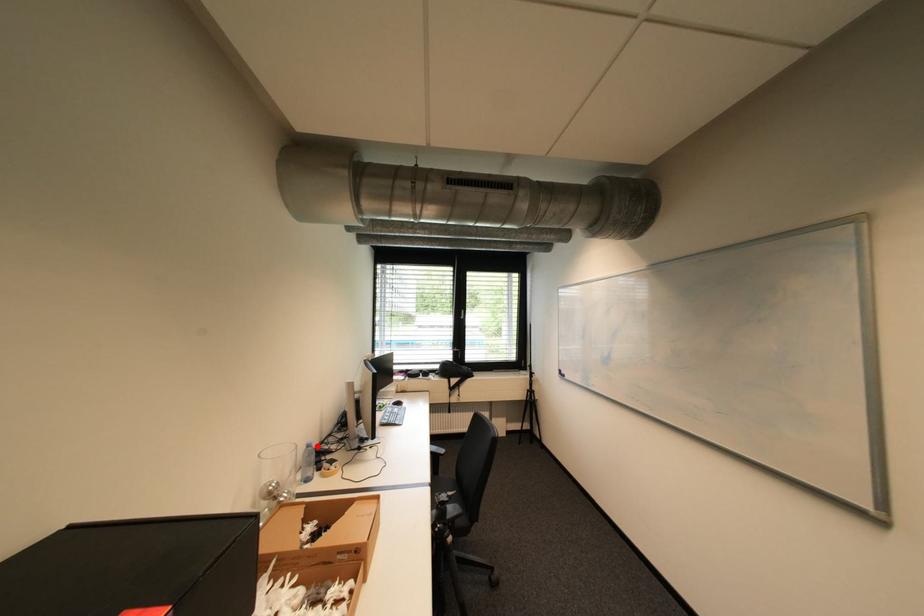
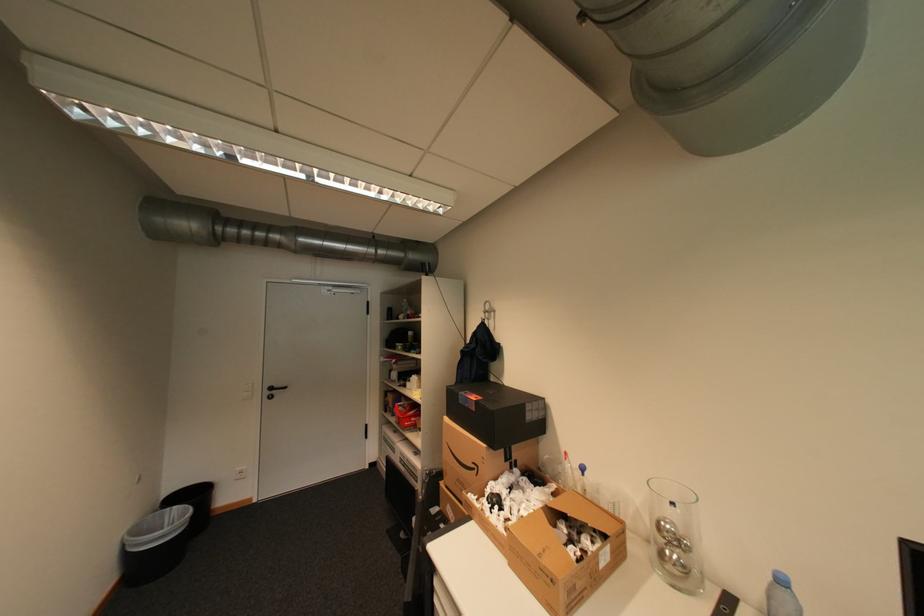
Where in the second image is the point corresponding to the highlighted location from the first image?

(791, 582)